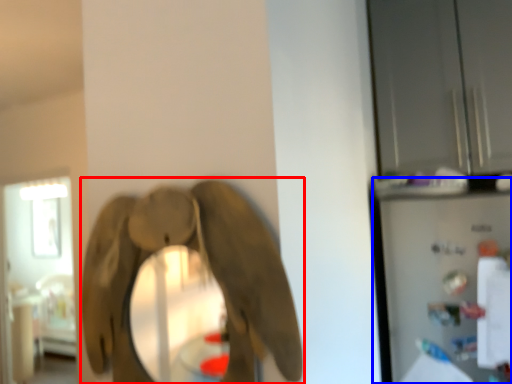
Question: Which point is further to the camera, elephant (highlighted by a red box) or appliance (highlighted by a blue box)?

Choices:
 (A) elephant
 (B) appliance

Answer: (B)